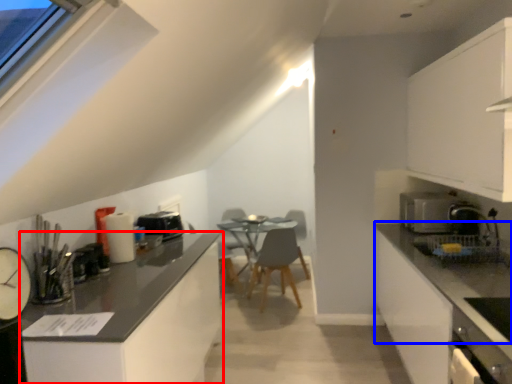
Question: Which object appears closest to the camera in this image, cabinetry (highlighted by a red box) or countertop (highlighted by a blue box)?

Choices:
 (A) cabinetry
 (B) countertop

Answer: (B)